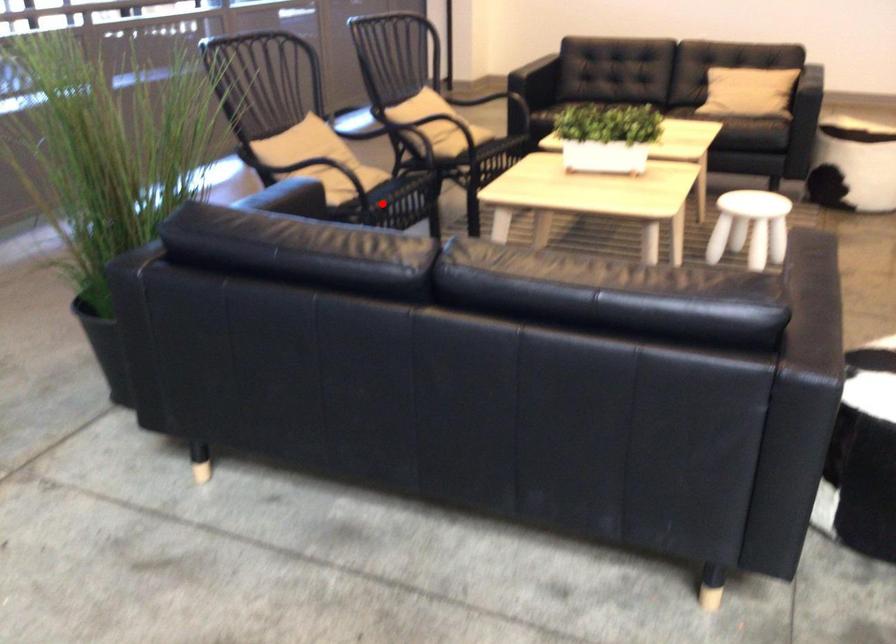
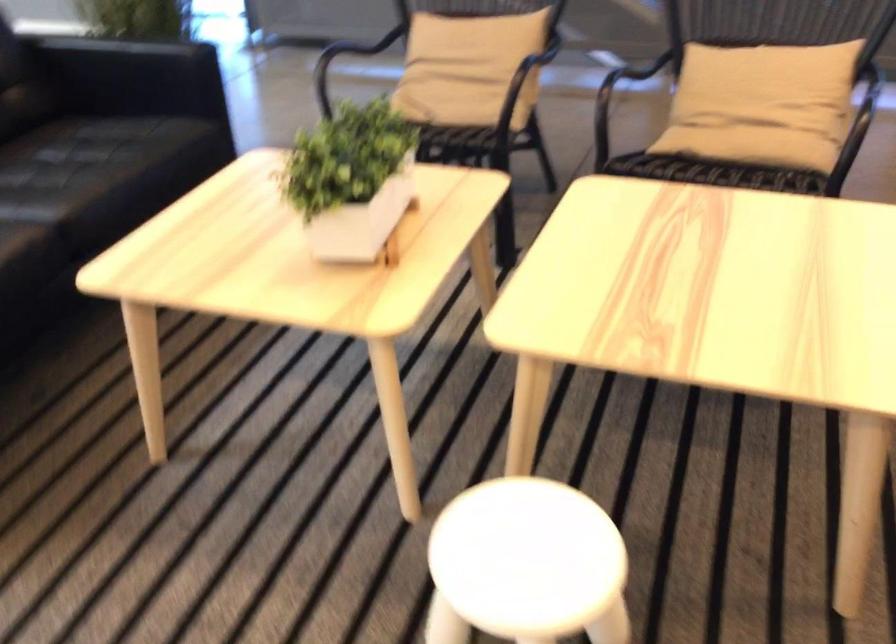
Question: I am providing you with two images of the same scene from different viewpoints. A red point is marked on the first image. Is the red point's position out of view in image 2?

Choices:
 (A) Yes
 (B) No

Answer: (A)